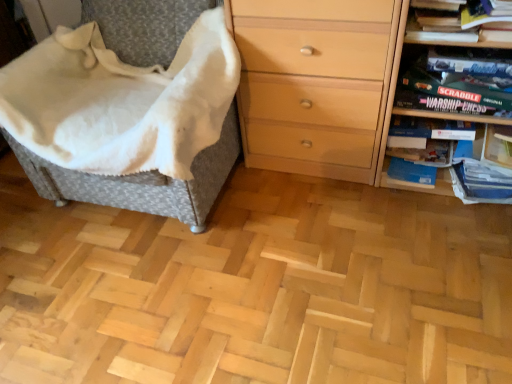
What do you see at coordinates (314, 83) in the screenshot?
I see `light wood chest of drawers at right` at bounding box center [314, 83].

Looking at this image, what is the approximate height of woven fabric chair at left?

woven fabric chair at left is 34.80 inches tall.

Locate an element on the screen. light wood chest of drawers at right is located at coordinates (314, 83).

Is wooden board game at right positioned beyond the bounds of light wood chest of drawers at right?

No, wooden board game at right is not entirely external to light wood chest of drawers at right.

In the image, there is a light wood chest of drawers at right. At what (x,y) coordinates should I click in order to perform the action: click on shelf below it (from a real-world perspective). Please return your answer as a coordinate pair (x, y). The width and height of the screenshot is (512, 384). Looking at the image, I should click on (412, 186).

Is wooden board game at right directly adjacent to light wood chest of drawers at right?

No, wooden board game at right is not beside light wood chest of drawers at right.

Does wooden board game at right appear on the right side of light wood chest of drawers at right?

Indeed, wooden board game at right is positioned on the right side of light wood chest of drawers at right.

Locate an element on the screen. furniture that is on the left side of hardcover book at upper right is located at coordinates point(142,181).

Is woven fabric chair at left next to hardcover book at upper right?

No, woven fabric chair at left is not with hardcover book at upper right.

Is point (161, 42) closer to viewer compared to point (409, 27)?

That is False.

Does woven fabric chair at left have a lesser width compared to hardcover book at upper right?

Incorrect, the width of woven fabric chair at left is not less than that of hardcover book at upper right.

Is hardcover book at upper right at the right side of wooden board game at right?

No, hardcover book at upper right is not to the right of wooden board game at right.

From the image's perspective, is hardcover book at upper right on wooden board game at right?

Correct, hardcover book at upper right appears higher than wooden board game at right in the image.

Is hardcover book at upper right completely or partially outside of wooden board game at right?

Yes.

This screenshot has width=512, height=384. In order to click on book on the left of wooden board game at right in this screenshot , I will do `click(444, 23)`.

Consider the image. Is woven fabric chair at left positioned with its back to matte black game box at upper right?

No, woven fabric chair at left's orientation is not away from matte black game box at upper right.

Considering the sizes of objects woven fabric chair at left and matte black game box at upper right in the image provided, who is taller, woven fabric chair at left or matte black game box at upper right?

woven fabric chair at left.

Which object is wider, woven fabric chair at left or matte black game box at upper right?

With larger width is woven fabric chair at left.

From a real-world perspective, which is physically below, hardcover book at upper right or matte black game box at upper right?

matte black game box at upper right is physically lower.

Consider the image. In the image, is hardcover book at upper right positioned in front of or behind matte black game box at upper right?

In the image, hardcover book at upper right appears in front of matte black game box at upper right.

From the image's perspective, is hardcover book at upper right above or below matte black game box at upper right?

Clearly, from the image's perspective, hardcover book at upper right is above matte black game box at upper right.

How much distance is there between hardcover book at upper right and matte black game box at upper right?

They are 7.49 inches apart.

Consider the image. Is light wood chest of drawers at right positioned with its back to matte black game box at upper right?

Absolutely, light wood chest of drawers at right is directed away from matte black game box at upper right.

Considering the sizes of objects light wood chest of drawers at right and matte black game box at upper right in the image provided, who is bigger, light wood chest of drawers at right or matte black game box at upper right?

light wood chest of drawers at right is bigger.

Considering the positions of objects light wood chest of drawers at right and matte black game box at upper right in the image provided, who is in front, light wood chest of drawers at right or matte black game box at upper right?

Positioned in front is light wood chest of drawers at right.

How different are the orientations of matte black game box at upper right and hardcover book at upper right in degrees?

0.000589 degrees separate the facing orientations of matte black game box at upper right and hardcover book at upper right.

Is hardcover book at upper right a part of matte black game box at upper right?

That's incorrect, hardcover book at upper right is not inside matte black game box at upper right.

From a real-world perspective, is matte black game box at upper right on hardcover book at upper right?

No, from a real-world perspective, matte black game box at upper right is not on top of hardcover book at upper right.

Between matte black game box at upper right and hardcover book at upper right, which one has smaller width?

With smaller width is hardcover book at upper right.

You are a GUI agent. You are given a task and a screenshot of the screen. Output one action in this format:
    pyautogui.click(x=<x>, y=<y>)
    Task: Click on the chest of drawers above the wooden board game at right (from the image's perspective)
    This screenshot has width=512, height=384.
    Given the screenshot: What is the action you would take?
    pyautogui.click(x=314, y=83)

The height and width of the screenshot is (384, 512). In order to click on furniture in front of the hardcover book at upper right in this screenshot , I will do `click(142, 181)`.

Based on their spatial positions, is matte black game box at upper right or woven fabric chair at left further from wooden board game at right?

woven fabric chair at left lies further to wooden board game at right than the other object.

Looking at this image, which object lies nearer to the anchor point light wood chest of drawers at right, matte black game box at upper right or hardcover book at upper right?

The object closer to light wood chest of drawers at right is matte black game box at upper right.

When comparing their distances from light wood chest of drawers at right, does woven fabric chair at left or wooden board game at right seem further?

woven fabric chair at left is further to light wood chest of drawers at right.

Which object lies nearer to the anchor point wooden board game at right, woven fabric chair at left or matte black game box at upper right?

matte black game box at upper right lies closer to wooden board game at right than the other object.

Looking at the image, which one is located closer to hardcover book at upper right, woven fabric chair at left or matte black game box at upper right?

matte black game box at upper right.

Based on their spatial positions, is matte black game box at upper right or wooden board game at right further from woven fabric chair at left?

matte black game box at upper right lies further to woven fabric chair at left than the other object.

Estimate the real-world distances between objects in this image. Which object is closer to woven fabric chair at left, matte black game box at upper right or light wood chest of drawers at right?

Based on the image, light wood chest of drawers at right appears to be nearer to woven fabric chair at left.

Consider the image. From the image, which object appears to be nearer to light wood chest of drawers at right, matte black game box at upper right or wooden board game at right?

wooden board game at right is positioned closer to the anchor light wood chest of drawers at right.

This screenshot has width=512, height=384. In order to click on book between woven fabric chair at left and wooden board game at right in the horizontal direction in this screenshot , I will do `click(444, 23)`.

Where is `the chest of drawers located between woven fabric chair at left and matte black game box at upper right in the left-right direction`? This screenshot has height=384, width=512. the chest of drawers located between woven fabric chair at left and matte black game box at upper right in the left-right direction is located at coordinates (314, 83).

Identify the location of paperback book between woven fabric chair at left and wooden board game at right. (457, 92).

You are a GUI agent. You are given a task and a screenshot of the screen. Output one action in this format:
    pyautogui.click(x=<x>, y=<y>)
    Task: Click on the chest of drawers that lies between hardcover book at upper right and wooden board game at right from top to bottom
    
    Given the screenshot: What is the action you would take?
    pyautogui.click(x=314, y=83)